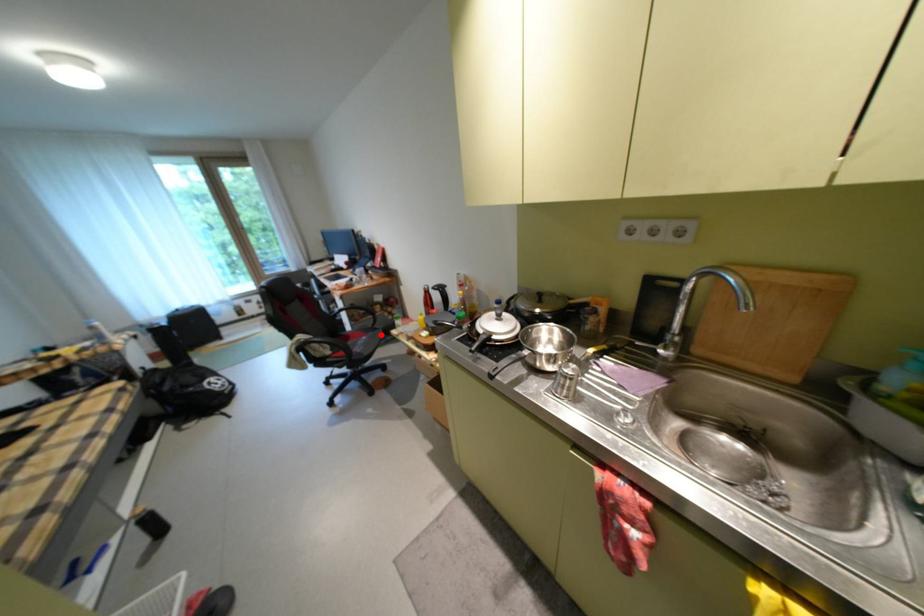
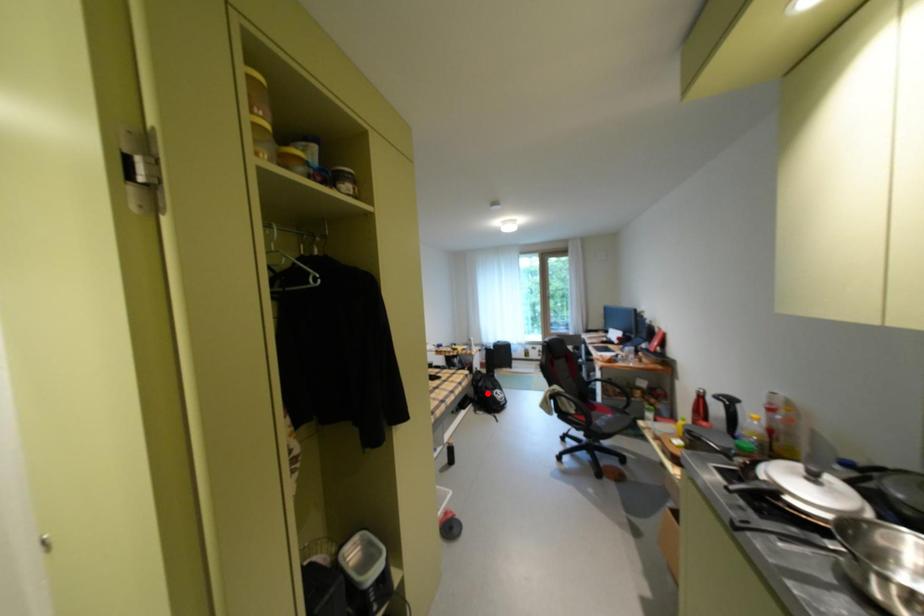
I am providing you with two images of the same scene from different viewpoints. A red point is marked on the first image and another point is marked on the second image. Does the point marked in image1 correspond to the same location as the one in image2?

No